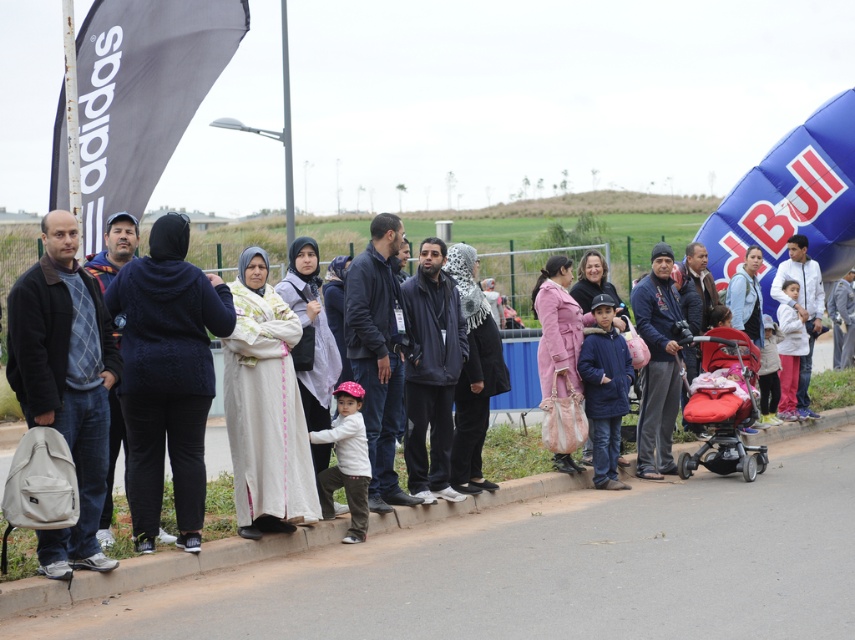
Is dark blue hoodie at center to the right of matte white shirt at center from the viewer's perspective?

Correct, you'll find dark blue hoodie at center to the right of matte white shirt at center.

Find the location of `dark blue hoodie at center`. dark blue hoodie at center is located at coordinates (513, 451).

Can you confirm if brown concrete curb at lower center is positioned to the left of matte black jacket at left?

No, brown concrete curb at lower center is not to the left of matte black jacket at left.

Where is `brown concrete curb at lower center`? brown concrete curb at lower center is located at coordinates (x=544, y=570).

Find the location of `brown concrete curb at lower center`. brown concrete curb at lower center is located at coordinates (544, 570).

Is point (128, 429) closer to viewer compared to point (97, 376)?

No, (128, 429) is behind (97, 376).

Is point (174, 448) in front of point (84, 532)?

No, (174, 448) is behind (84, 532).

In order to click on dark blue fleece at center in this screenshot , I will do `click(167, 376)`.